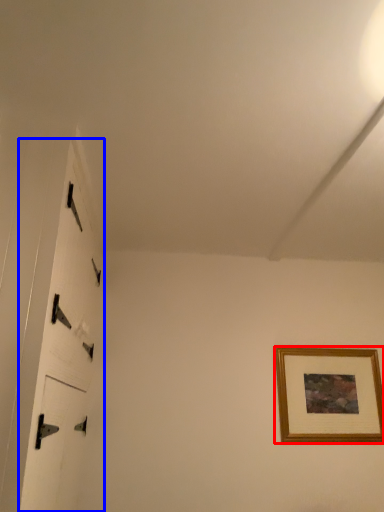
Question: Among these objects, which one is farthest to the camera, picture frame (highlighted by a red box) or door (highlighted by a blue box)?

Choices:
 (A) picture frame
 (B) door

Answer: (A)